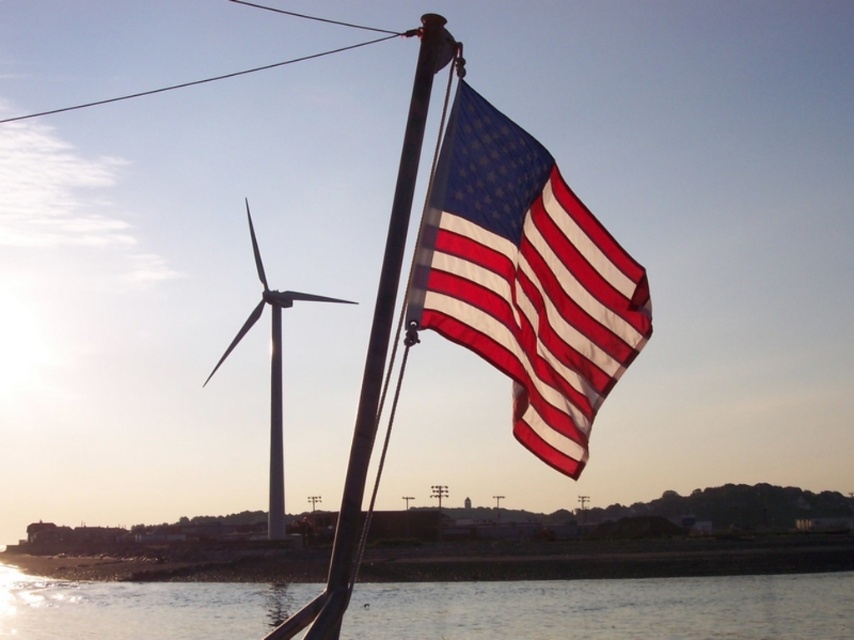
Is american flag at center bigger than white smooth wind turbine at left?

No.

Does point (489, 244) come closer to viewer compared to point (252, 237)?

Yes.

Find the location of a particular element. Image resolution: width=854 pixels, height=640 pixels. american flag at center is located at coordinates (525, 280).

Is transparent water at lower center shorter than metallic flag pole at center?

Incorrect, transparent water at lower center's height does not fall short of metallic flag pole at center's.

Between transparent water at lower center and metallic flag pole at center, which one appears on the right side from the viewer's perspective?

metallic flag pole at center is more to the right.

Between point (495, 589) and point (422, 86), which one is positioned in front?

Point (422, 86) is in front.

At what (x,y) coordinates should I click in order to perform the action: click on transparent water at lower center. Please return your answer as a coordinate pair (x, y). This screenshot has width=854, height=640. Looking at the image, I should click on (607, 609).

From the picture: Which is more to the left, american flag at center or transparent water at lower center?

Positioned to the left is transparent water at lower center.

Who is more distant from viewer, (589,276) or (126,614)?

The point (126,614) is more distant.

Is point (519, 157) closer to viewer compared to point (443, 602)?

That is True.

Where is `american flag at center`? This screenshot has width=854, height=640. american flag at center is located at coordinates (525, 280).